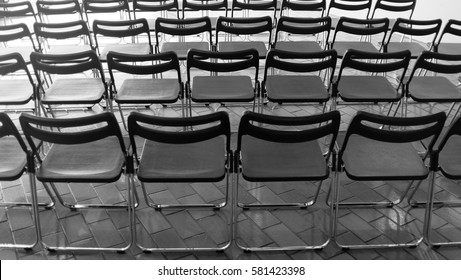
Locate an element on the screen. Image resolution: width=461 pixels, height=280 pixels. interlocking floor is located at coordinates (155, 227).